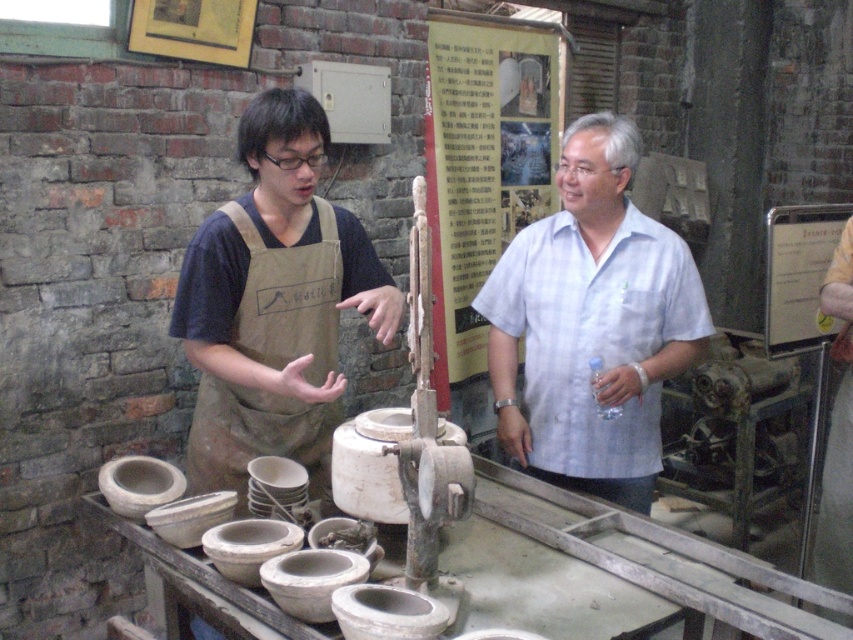
Describe the element at coordinates (592, 323) in the screenshot. I see `white cotton shirt at center` at that location.

Which is above, white cotton shirt at center or brown canvas apron at left?

brown canvas apron at left

Who is more distant from viewer, (515,349) or (316,250)?

Point (515,349)

Identify the location of white cotton shirt at center. Image resolution: width=853 pixels, height=640 pixels. (592, 323).